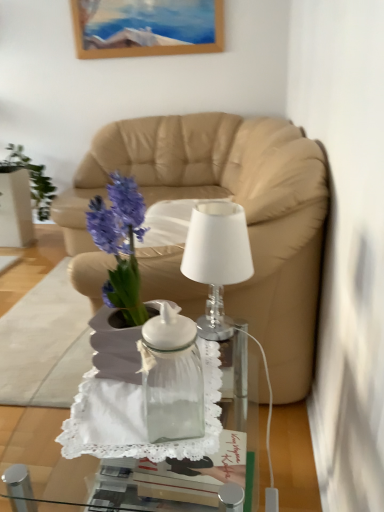
Question: Is point (125, 439) closer or farther from the camera than point (314, 214)?

Choices:
 (A) closer
 (B) farther

Answer: (A)

Question: Would you say transparent glass jar at center is inside or outside beige leather couch at center?

Choices:
 (A) outside
 (B) inside

Answer: (A)

Question: Based on their relative distances, which object is nearer to the white glass lamp at center?

Choices:
 (A) transparent glass vase at center
 (B) transparent glass jar at center
 (C) beige leather couch at center

Answer: (B)

Question: Which of these objects is positioned closest to the beige leather couch at center?

Choices:
 (A) white glass lamp at center
 (B) transparent glass vase at center
 (C) transparent glass jar at center

Answer: (A)